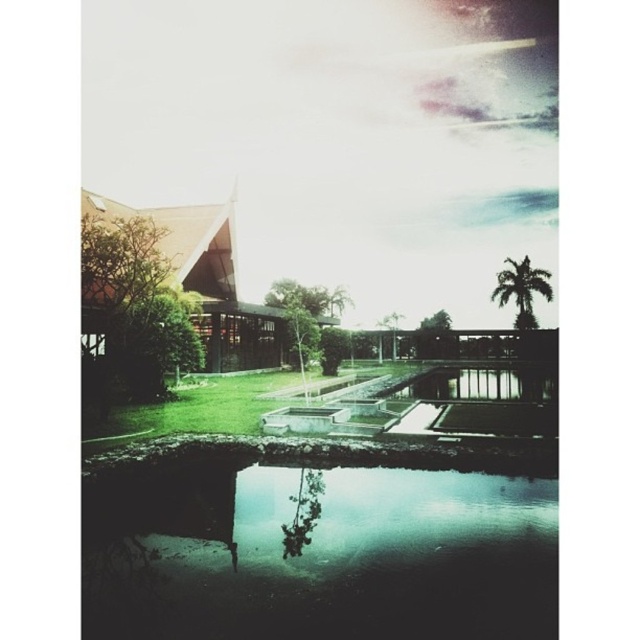
In the scene shown: Who is shorter, green reflective water at bottom or green leafy palm tree at upper right?

Standing shorter between the two is green reflective water at bottom.

Identify the location of green reflective water at bottom. The height and width of the screenshot is (640, 640). (317, 554).

Between point (516, 544) and point (538, 292), which one is positioned in front?

Point (516, 544)

The height and width of the screenshot is (640, 640). I want to click on green reflective water at bottom, so click(x=317, y=554).